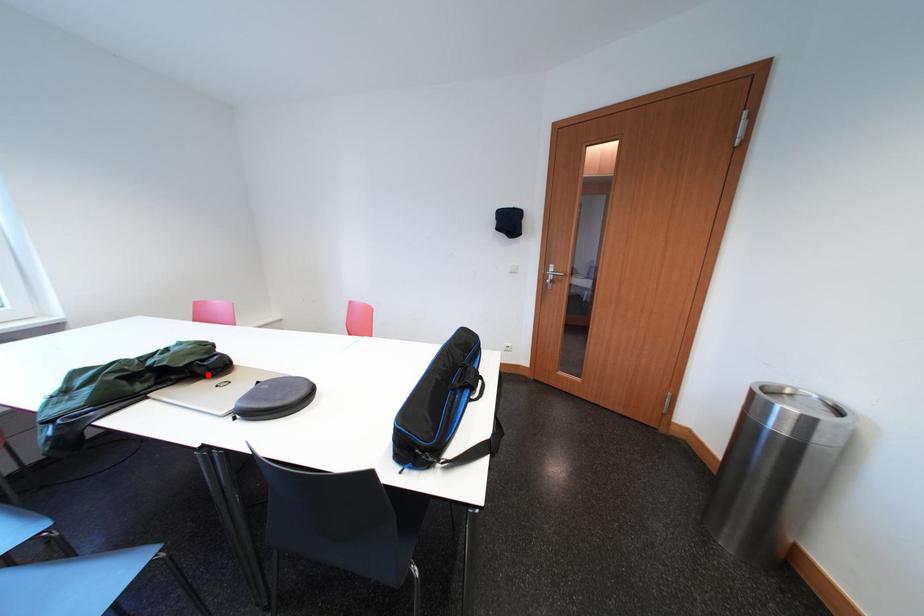
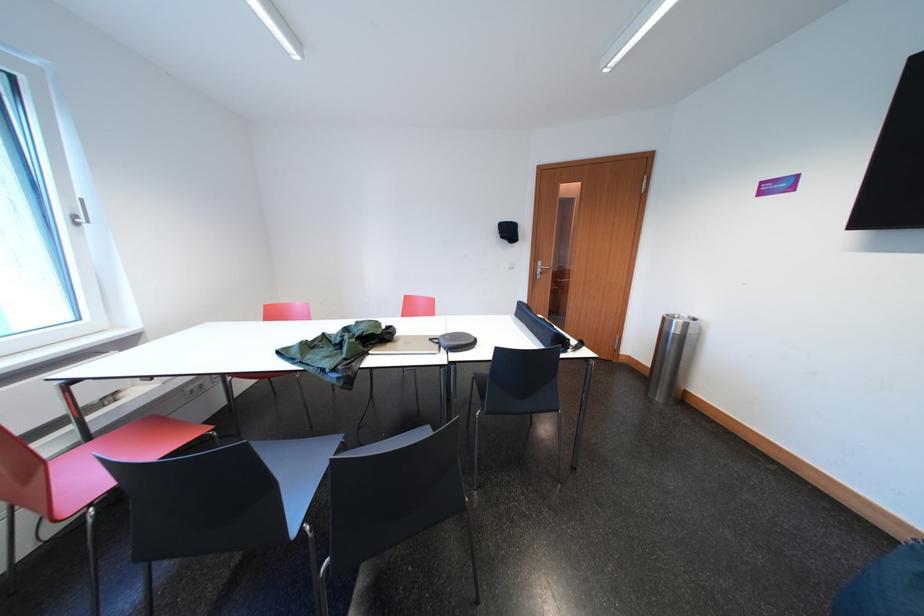
Locate, in the second image, the point that corresponds to the highlighted location in the first image.

(395, 341)